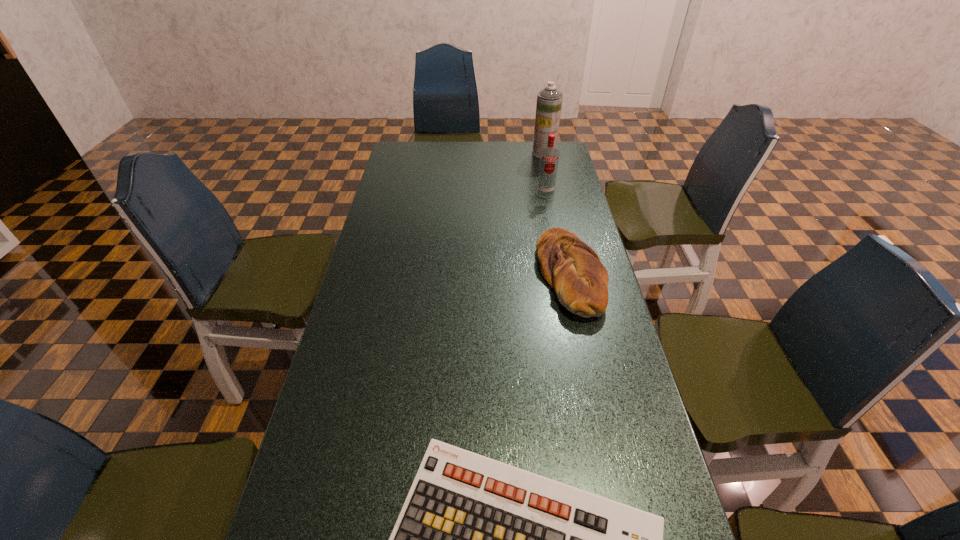
Find the location of a particular element. object that is the third closest to the third shortest object is located at coordinates (477, 539).

Locate an element on the screen. Image resolution: width=960 pixels, height=540 pixels. vacant space that satisfies the following two spatial constraints: 1. on the back side of the aerosol can; 2. on the left side of the third tallest object is located at coordinates (543, 153).

Find the location of a particular element. This screenshot has width=960, height=540. vacant position in the image that satisfies the following two spatial constraints: 1. on the front label of the vodka; 2. on the right side of the third tallest object is located at coordinates (562, 273).

At what (x,y) coordinates should I click in order to perform the action: click on vacant area in the image that satisfies the following two spatial constraints: 1. on the front label of the second nearest object; 2. on the right side of the second farthest object. Please return your answer as a coordinate pair (x, y). The image size is (960, 540). Looking at the image, I should click on (562, 273).